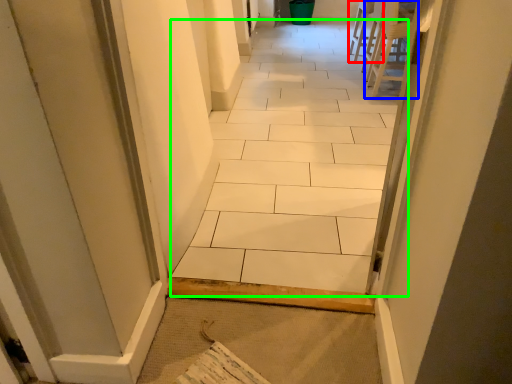
Question: Which object is positioned closest to chair (highlighted by a red box)? Select from chair (highlighted by a blue box) and ceramic tile (highlighted by a green box).

Choices:
 (A) chair
 (B) ceramic tile

Answer: (A)